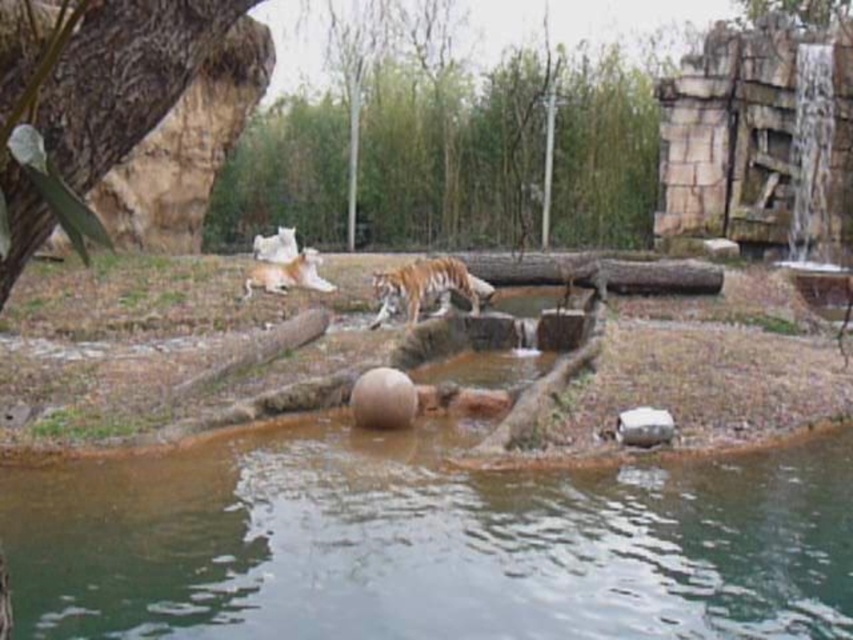
Question: Which object appears closest to the camera in this image?

Choices:
 (A) orange striped fur tiger at center
 (B) orange fur tiger at center
 (C) brown wood tree at upper center
 (D) rough bark tree at upper left

Answer: (D)

Question: Which of the following is the closest to the observer?

Choices:
 (A) (x=471, y=307)
 (B) (x=537, y=182)
 (C) (x=187, y=13)
 (D) (x=299, y=280)

Answer: (C)

Question: Is rough bark tree at upper left further to camera compared to orange striped fur tiger at center?

Choices:
 (A) yes
 (B) no

Answer: (B)

Question: Which of these objects is positioned closest to the rough bark tree at upper left?

Choices:
 (A) brown wood tree at upper center
 (B) orange striped fur tiger at center
 (C) orange fur tiger at center

Answer: (B)

Question: Does rough bark tree at upper left have a greater width compared to orange striped fur tiger at center?

Choices:
 (A) no
 (B) yes

Answer: (A)

Question: Can you confirm if brown wood tree at upper center is wider than orange fur tiger at center?

Choices:
 (A) yes
 (B) no

Answer: (A)